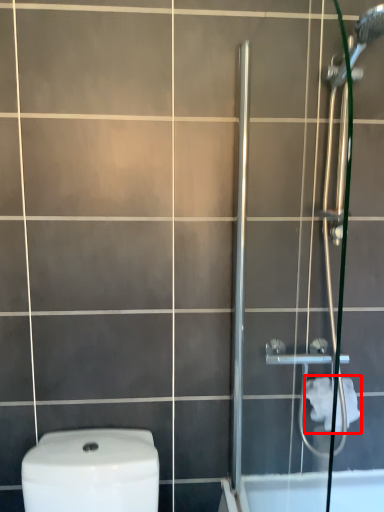
Question: From the image, what is the correct spatial relationship of toilet paper (annotated by the red box) in relation to screen door?

Choices:
 (A) left
 (B) right

Answer: (B)